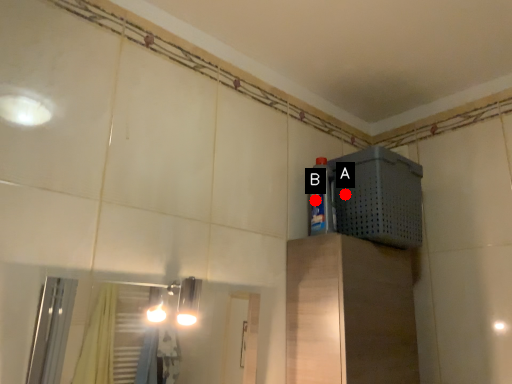
Question: Two points are circled on the image, labeled by A and B beside each circle. Which point is farther from the camera taking this photo?

Choices:
 (A) A is further
 (B) B is further

Answer: (A)